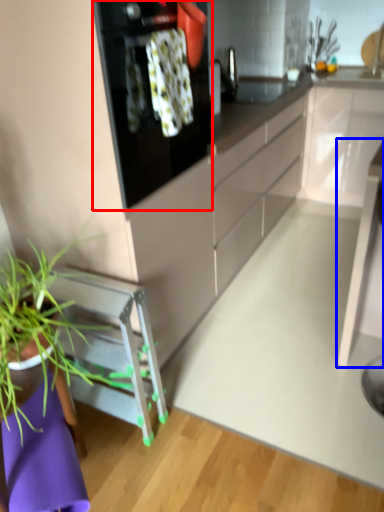
Question: Which object appears farthest to the camera in this image, kitchen appliance (highlighted by a red box) or table (highlighted by a blue box)?

Choices:
 (A) kitchen appliance
 (B) table

Answer: (B)